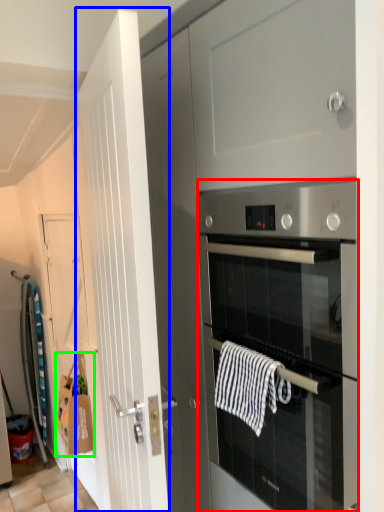
Question: Which is nearer to the oven (highlighted by a red box)? door (highlighted by a blue box) or hand towel (highlighted by a green box).

Choices:
 (A) door
 (B) hand towel

Answer: (A)